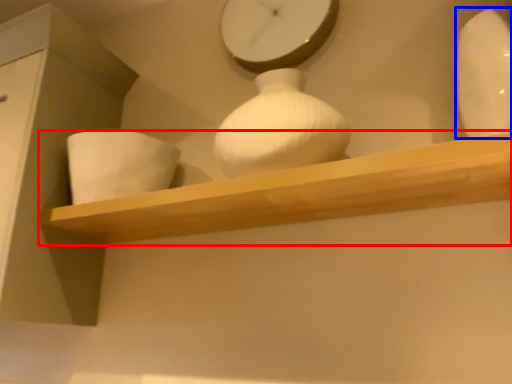
Question: Which of the following is the closest to the observer, shelf (highlighted by a red box) or vase (highlighted by a blue box)?

Choices:
 (A) shelf
 (B) vase

Answer: (B)